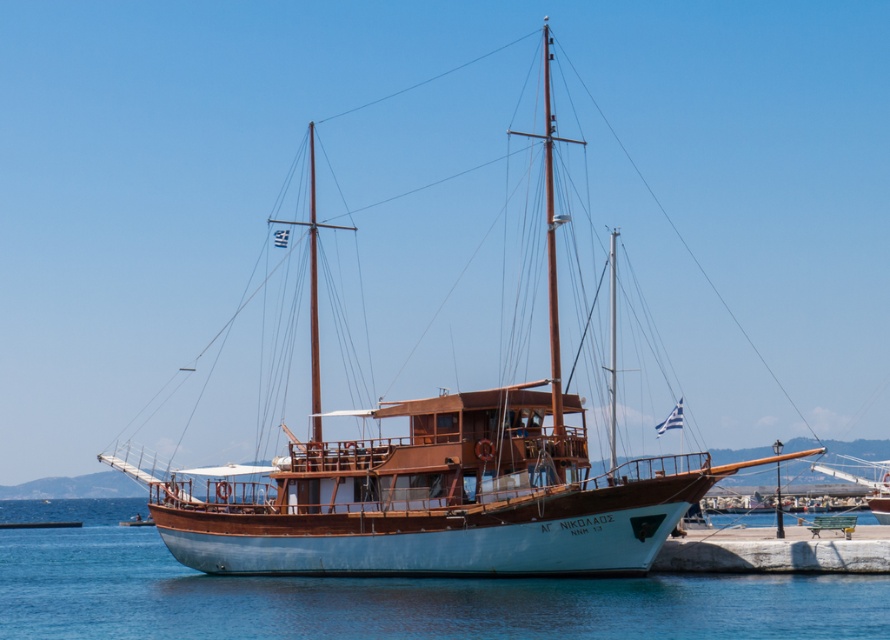
Question: Is white wooden sailboat at center thinner than white smooth water at center?

Choices:
 (A) no
 (B) yes

Answer: (B)

Question: Which point is closer to the camera?

Choices:
 (A) white wooden sailboat at center
 (B) white smooth water at center

Answer: (B)

Question: Which object appears closest to the camera in this image?

Choices:
 (A) white smooth water at center
 (B) white wooden sailboat at center

Answer: (A)

Question: Which of the following is the closest to the observer?

Choices:
 (A) white smooth water at center
 (B) white wooden sailboat at center

Answer: (A)

Question: Can you confirm if white wooden sailboat at center is positioned to the left of white smooth water at center?

Choices:
 (A) no
 (B) yes

Answer: (A)

Question: Can you confirm if white wooden sailboat at center is positioned above white smooth water at center?

Choices:
 (A) yes
 (B) no

Answer: (A)